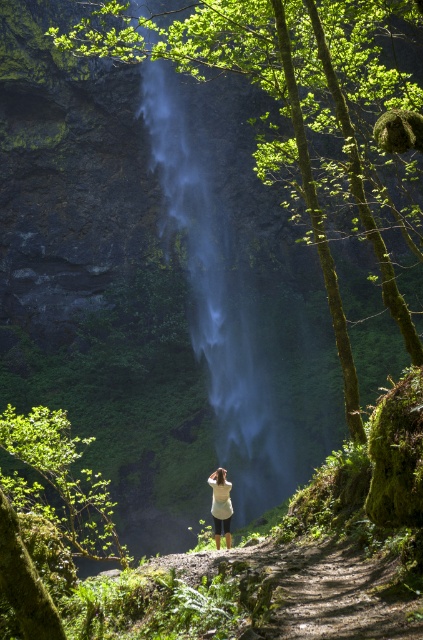
You are a photographer trying to capture a photo of the translucent misty waterfall at center and the white matte shirt at center. You want to ensure both are in focus. Given that your camera can only focus on objects within a 50 feet range, will you be able to capture both in focus?

The distance between the translucent misty waterfall at center and the white matte shirt at center is 89.15 feet, which exceeds the camera focus range of 50 feet. Therefore, you cannot have both in focus simultaneously.

You are a photographer trying to capture the white matte shirt at center and the translucent misty waterfall at center in a single shot. Which object should you focus on to ensure the subject is sharp?

The white matte shirt at center is behind the translucent misty waterfall at center, so focusing on the waterfall will ensure the shirt is also in focus since it is further away.

You are a photographer aiming to capture the white matte shirt at center and the translucent misty waterfall at center in the same frame. Based on their positions, will the waterfall appear in front of or behind the shirt in the photo?

The translucent misty waterfall at center is positioned over white matte shirt at center, so the waterfall will appear in front of the shirt in the photo.